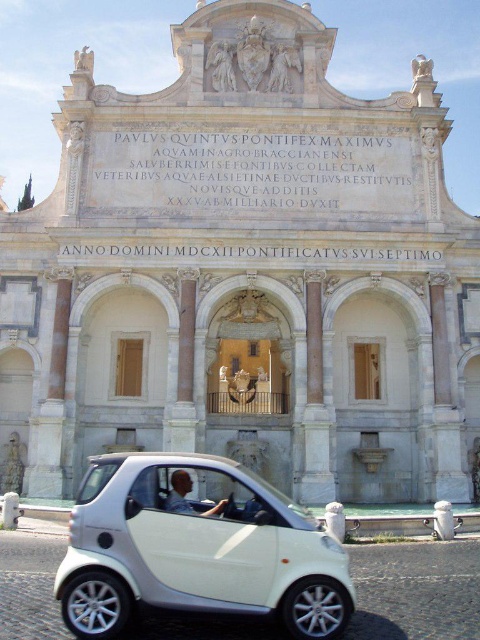
Question: From the image, what is the correct spatial relationship of white matte car at lower center in relation to light blue shirt at center?

Choices:
 (A) right
 (B) left

Answer: (B)

Question: Among these points, which one is farthest from the camera?

Choices:
 (A) (245, 582)
 (B) (215, 512)

Answer: (B)

Question: Does white matte car at lower center appear on the right side of light blue shirt at center?

Choices:
 (A) yes
 (B) no

Answer: (B)

Question: Does white matte car at lower center appear on the right side of light blue shirt at center?

Choices:
 (A) no
 (B) yes

Answer: (A)

Question: Among these objects, which one is nearest to the camera?

Choices:
 (A) white matte car at lower center
 (B) light blue shirt at center

Answer: (A)

Question: Which point is farther to the camera?

Choices:
 (A) 180,481
 (B) 345,627

Answer: (A)